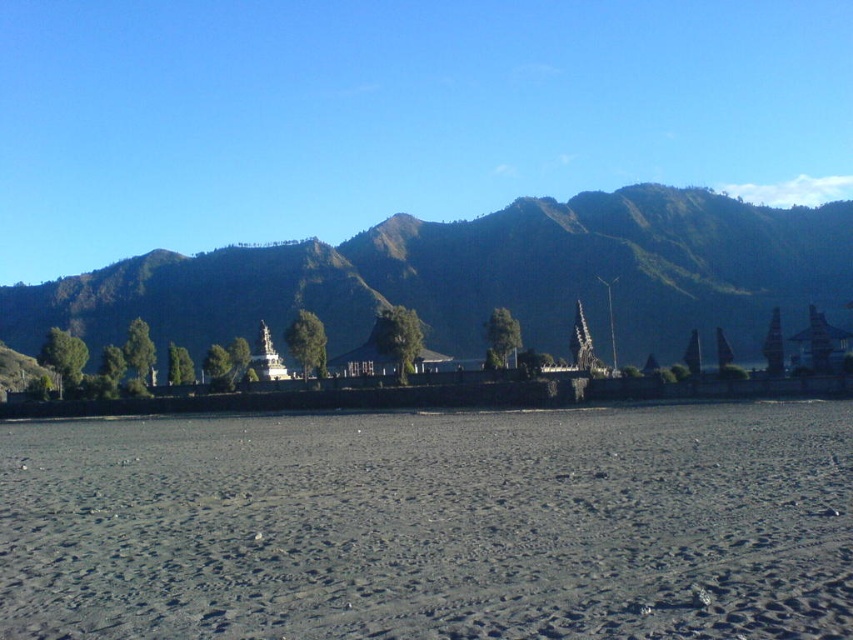
Is dark gray sand at center to the right of green grassy mountain at left from the viewer's perspective?

Correct, you'll find dark gray sand at center to the right of green grassy mountain at left.

Is dark gray sand at center bigger than green grassy mountain at left?

Actually, dark gray sand at center might be smaller than green grassy mountain at left.

What are the coordinates of `dark gray sand at center` in the screenshot? It's located at (432, 525).